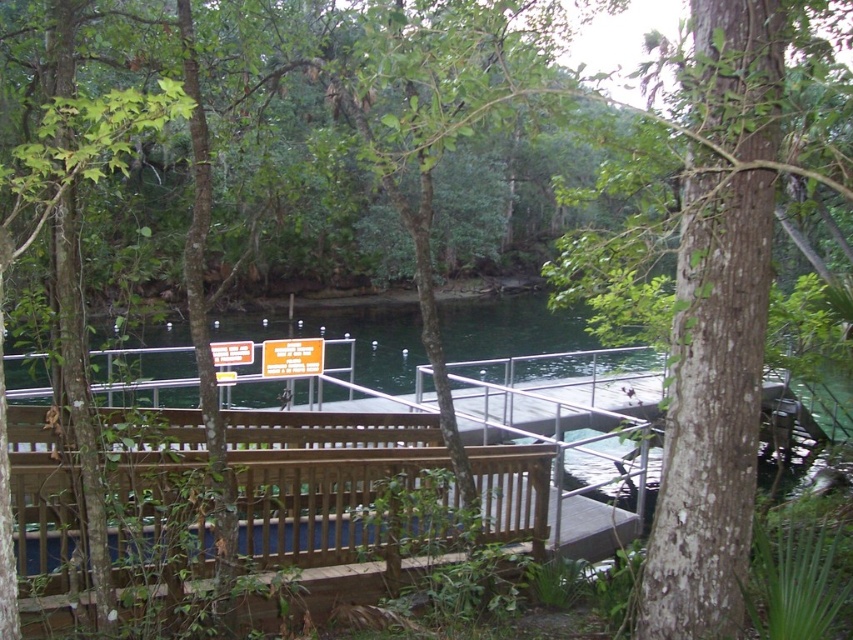
Is point (305, 374) farther from camera compared to point (239, 352)?

Yes, it is behind point (239, 352).

Consider the image. Measure the distance between point (286, 369) and camera.

Point (286, 369) is 11.85 meters from camera.

Who is more forward, (289, 360) or (241, 355)?

Point (241, 355) is more forward.

Where is `yellow plastic sign at center`? The image size is (853, 640). yellow plastic sign at center is located at coordinates (292, 356).